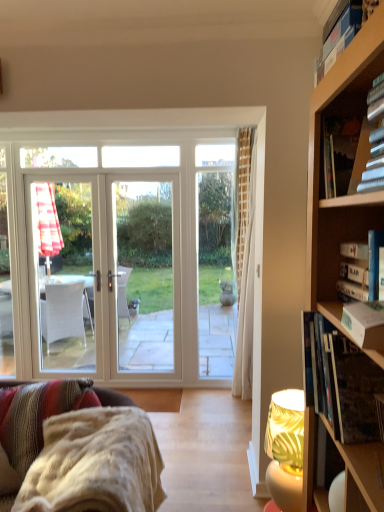
Question: From the image's perspective, is hardcover book at upper right, which appears as the 4th book when ordered from the bottom, under hardcover book at right, placed as the 1th book when sorted from bottom to top?

Choices:
 (A) yes
 (B) no

Answer: (B)

Question: Can you confirm if hardcover book at upper right, marked as the 2th book in a top-to-bottom arrangement, is thinner than hardcover book at right, which is the 5th book in top-to-bottom order?

Choices:
 (A) no
 (B) yes

Answer: (B)

Question: Is hardcover book at upper right, which appears as the 4th book when ordered from the bottom, oriented towards hardcover book at right, placed as the 1th book when sorted from bottom to top?

Choices:
 (A) yes
 (B) no

Answer: (B)

Question: Can you confirm if hardcover book at upper right, which appears as the 4th book when ordered from the bottom, is positioned to the right of hardcover book at right, which is the 5th book in top-to-bottom order?

Choices:
 (A) yes
 (B) no

Answer: (A)

Question: Is hardcover book at upper right, marked as the 2th book in a top-to-bottom arrangement, outside of hardcover book at right, which is the 5th book in top-to-bottom order?

Choices:
 (A) no
 (B) yes

Answer: (B)

Question: From the image's perspective, would you say green leaf-patterned fabric lampshade at lower right is positioned over white textured fabric couch at lower left?

Choices:
 (A) no
 (B) yes

Answer: (B)

Question: Is green leaf-patterned fabric lampshade at lower right outside white textured fabric couch at lower left?

Choices:
 (A) yes
 (B) no

Answer: (A)

Question: Considering the relative sizes of green leaf-patterned fabric lampshade at lower right and white textured fabric couch at lower left in the image provided, is green leaf-patterned fabric lampshade at lower right smaller than white textured fabric couch at lower left?

Choices:
 (A) yes
 (B) no

Answer: (A)

Question: Is green leaf-patterned fabric lampshade at lower right far from white textured fabric couch at lower left?

Choices:
 (A) yes
 (B) no

Answer: (B)

Question: Is the depth of green leaf-patterned fabric lampshade at lower right less than that of white textured fabric couch at lower left?

Choices:
 (A) yes
 (B) no

Answer: (B)

Question: Is green leaf-patterned fabric lampshade at lower right surrounding white textured fabric couch at lower left?

Choices:
 (A) no
 (B) yes

Answer: (A)

Question: Considering the relative sizes of hardcover book at right, marked as the third book in a top-to-bottom arrangement, and hardcover book at upper right, arranged as the fifth book when ordered from the bottom, in the image provided, is hardcover book at right, marked as the third book in a top-to-bottom arrangement, thinner than hardcover book at upper right, arranged as the fifth book when ordered from the bottom,?

Choices:
 (A) no
 (B) yes

Answer: (B)